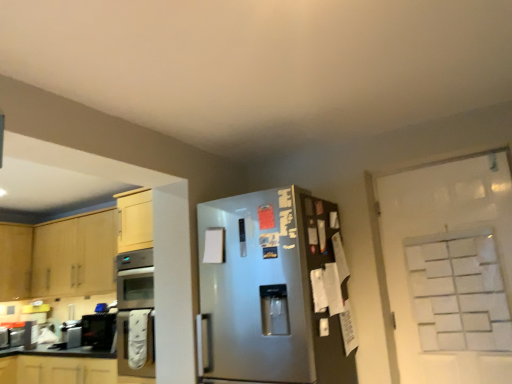
Identify the location of free space above white paperboard at right (from a real-world perspective). (432, 165).